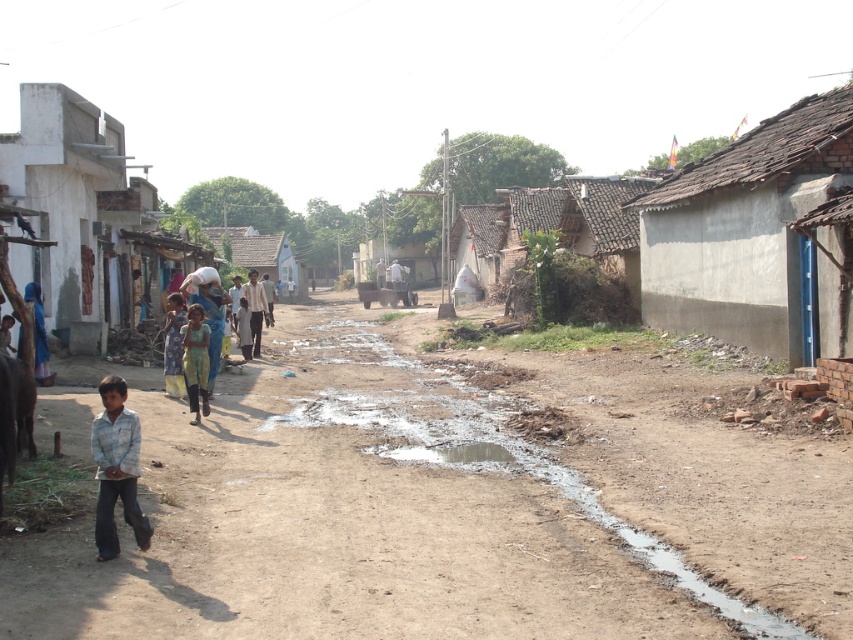
Can you confirm if white painted mud hut at upper left is wider than green fabric dress at center?

Correct, the width of white painted mud hut at upper left exceeds that of green fabric dress at center.

Is white painted mud hut at upper left positioned at the back of green fabric dress at center?

No, white painted mud hut at upper left is in front of green fabric dress at center.

Is point (83, 179) positioned behind point (186, 323)?

Yes.

Locate an element on the screen. white painted mud hut at upper left is located at coordinates (85, 218).

Is the position of light blue denim pants at lower left less distant than that of green fabric dress at center?

Yes, light blue denim pants at lower left is in front of green fabric dress at center.

Which is behind, point (117, 396) or point (206, 348)?

Positioned behind is point (206, 348).

Between point (111, 452) and point (207, 369), which one is positioned in front?

Positioned in front is point (111, 452).

Locate an element on the screen. The image size is (853, 640). light blue denim pants at lower left is located at coordinates (115, 468).

Does light blue denim pants at lower left have a larger size compared to blue fabric bag at center?

Actually, light blue denim pants at lower left might be smaller than blue fabric bag at center.

Is light blue denim pants at lower left thinner than blue fabric bag at center?

Yes, light blue denim pants at lower left is thinner than blue fabric bag at center.

Find the location of `light blue denim pants at lower left`. light blue denim pants at lower left is located at coordinates (115, 468).